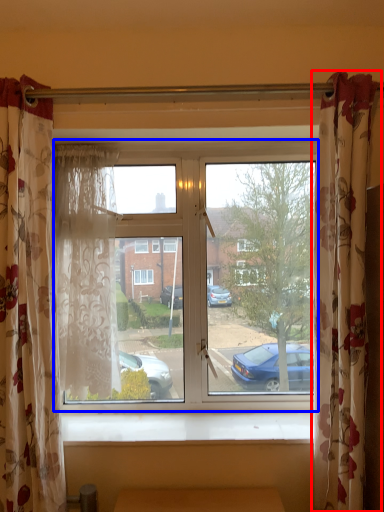
Question: Which object appears closest to the camera in this image, curtain (highlighted by a red box) or window (highlighted by a blue box)?

Choices:
 (A) curtain
 (B) window

Answer: (A)